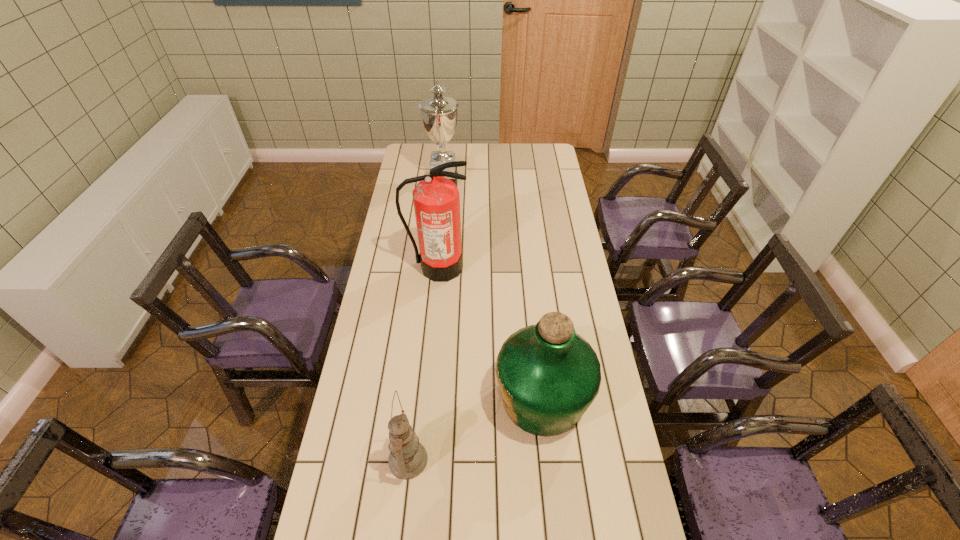
The width and height of the screenshot is (960, 540). I want to click on object situated at the far edge, so [x=439, y=113].

I want to click on trophy cup present at the left edge, so click(439, 113).

Find the location of a particular element. fire extinguisher that is at the left edge is located at coordinates (436, 199).

The image size is (960, 540). Identify the location of oil lamp that is positioned at the left edge. (408, 458).

Where is `object that is at the right edge`? Image resolution: width=960 pixels, height=540 pixels. object that is at the right edge is located at coordinates (548, 375).

Locate an element on the screen. The width and height of the screenshot is (960, 540). object present at the far left corner is located at coordinates (439, 113).

The height and width of the screenshot is (540, 960). In the image, there is a desktop. Find the location of `blank space at the far edge`. blank space at the far edge is located at coordinates (514, 151).

In the image, there is a desktop. At what (x,y) coordinates should I click in order to perform the action: click on free region at the left edge. Please return your answer as a coordinate pair (x, y). The image size is (960, 540). Looking at the image, I should click on (391, 238).

At what (x,y) coordinates should I click in order to perform the action: click on vacant region at the right edge of the desktop. Please return your answer as a coordinate pair (x, y). Looking at the image, I should click on (598, 406).

Find the location of a particular element. vacant space that is in between the second farthest object and the liquor is located at coordinates (490, 333).